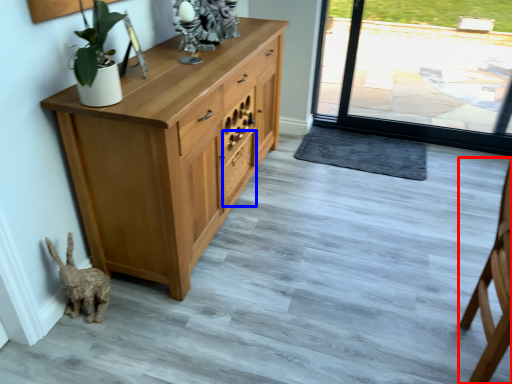
Question: Among these objects, which one is nearest to the camera, chair (highlighted by a red box) or drawer (highlighted by a blue box)?

Choices:
 (A) chair
 (B) drawer

Answer: (A)